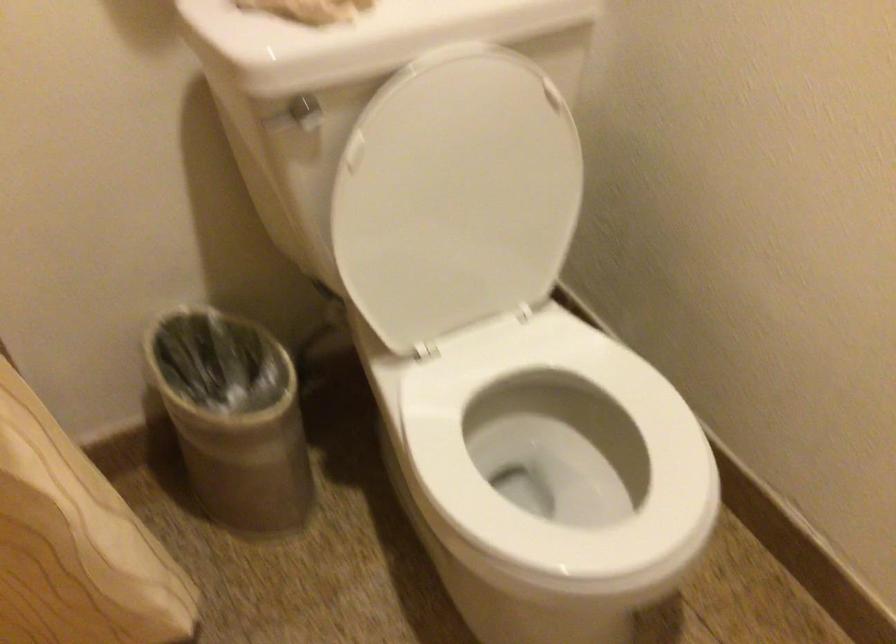
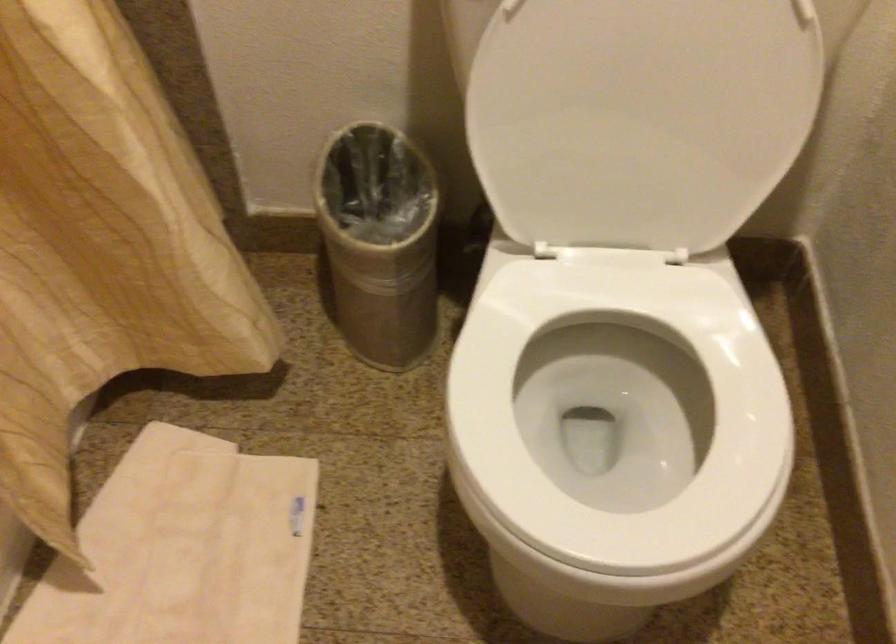
Find the pixel in the second image that matches the point at 264,412 in the first image.

(380, 242)